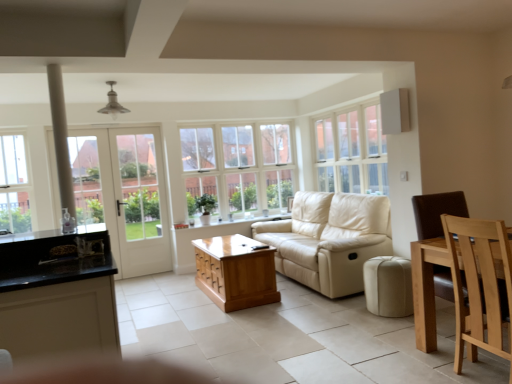
Question: Is white wood window at upper center, which is the third window in left-to-right order, inside the boundaries of beige leather ottoman at lower center, or outside?

Choices:
 (A) outside
 (B) inside

Answer: (A)

Question: Does point (368, 150) appear closer or farther from the camera than point (409, 306)?

Choices:
 (A) closer
 (B) farther

Answer: (B)

Question: Considering the real-world distances, which object is closest to the cream leather studio couch at center?

Choices:
 (A) beige leather ottoman at lower center
 (B) clear glass window at center, the second window from the right
 (C) white glass door at left
 (D) white wood window at upper center, the 1th window in the right-to-left sequence
 (E) brown wooden chair at right

Answer: (D)

Question: Considering the real-world distances, which object is farthest from the cream leather studio couch at center?

Choices:
 (A) white glass door at left
 (B) wooden coffee table at center
 (C) beige leather ottoman at lower center
 (D) clear glass window at left, arranged as the first window when viewed from the left
 (E) brown wooden chair at right

Answer: (D)